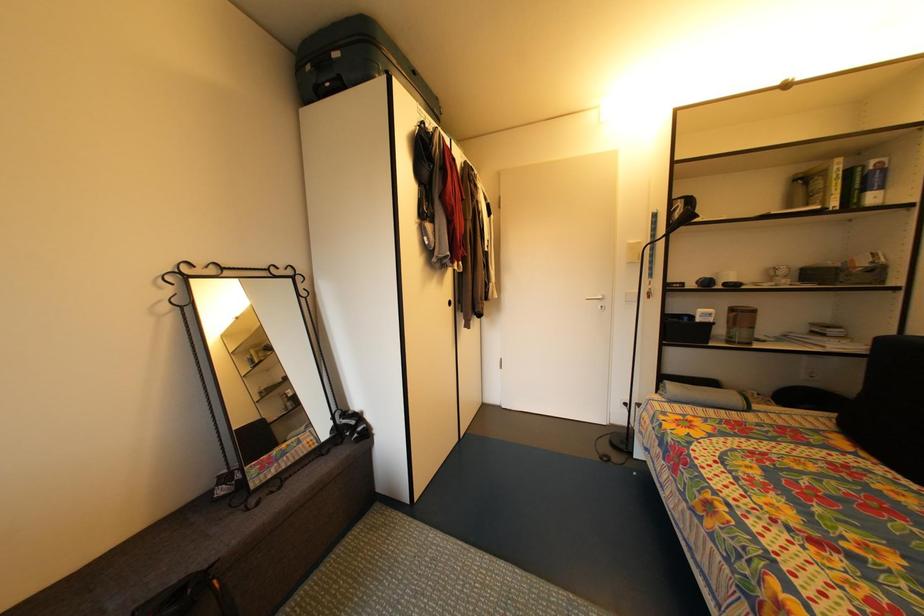
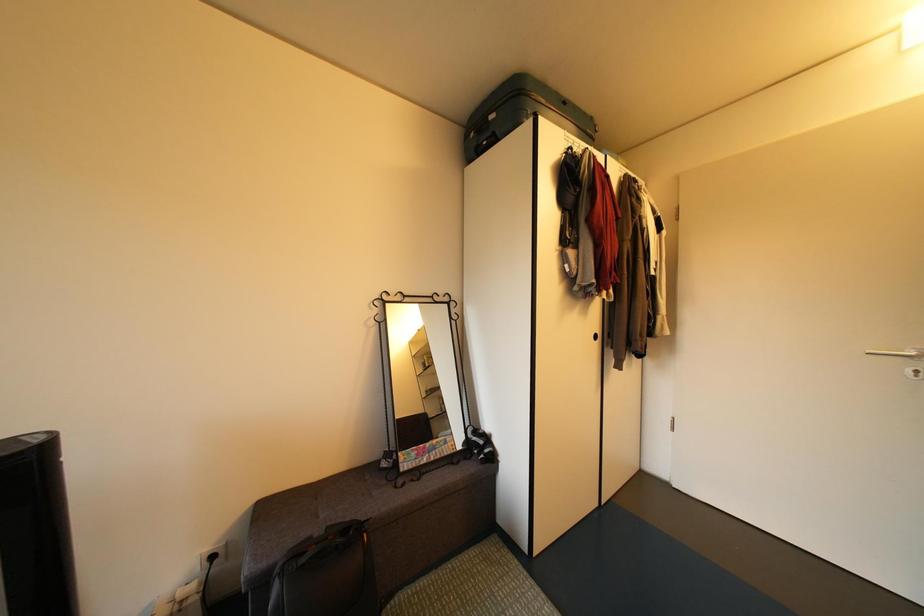
Question: The camera is either moving clockwise (left) or counter-clockwise (right) around the object. The first image is from the beginning of the video and the second image is from the end. Is the camera moving left or right when shooting the video?

Choices:
 (A) Left
 (B) Right

Answer: (B)